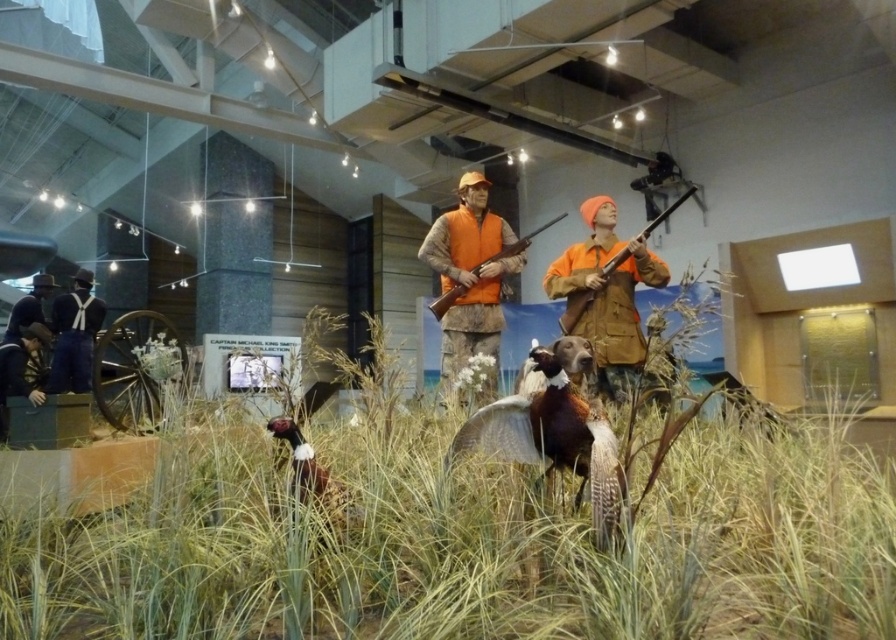
Question: Which of the following is the closest to the observer?

Choices:
 (A) (609, 445)
 (B) (80, 355)

Answer: (A)

Question: Which point is farther to the camera?

Choices:
 (A) (490, 257)
 (B) (565, 461)

Answer: (A)

Question: Observing the image, what is the correct spatial positioning of orange fabric vest at center in reference to blue denim overalls at left?

Choices:
 (A) below
 (B) above

Answer: (B)

Question: Is green grass at center above brown feathered bird at center?

Choices:
 (A) yes
 (B) no

Answer: (B)

Question: Can you confirm if orange fabric vest at center is thinner than leather jacket at lower left?

Choices:
 (A) no
 (B) yes

Answer: (A)

Question: Which point is closer to the camera taking this photo?

Choices:
 (A) (325, 492)
 (B) (472, 244)
 (C) (582, 486)
 (D) (11, 342)

Answer: (C)